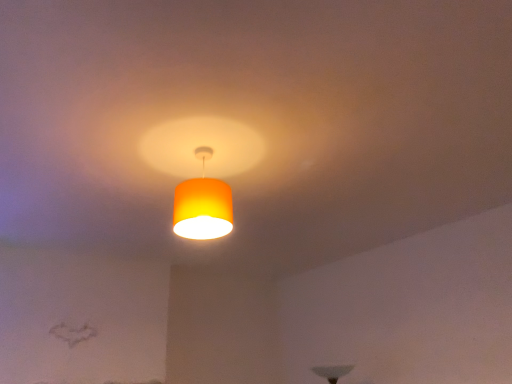
Where is `orange matte lampshade at center`? orange matte lampshade at center is located at coordinates (203, 205).

From the picture: Measure the distance between orange matte lampshade at center and camera.

They are 1.75 meters apart.

This screenshot has height=384, width=512. Describe the element at coordinates (203, 205) in the screenshot. I see `orange matte lampshade at center` at that location.

I want to click on orange matte lampshade at center, so click(x=203, y=205).